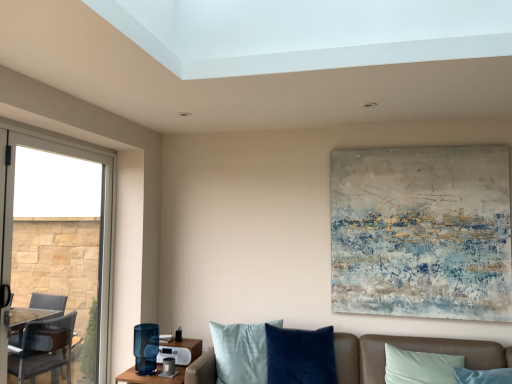
Question: Can you confirm if leather couch at lower right is positioned to the left of velvet brown couch at lower center?

Choices:
 (A) yes
 (B) no

Answer: (B)

Question: Would you consider leather couch at lower right to be distant from velvet brown couch at lower center?

Choices:
 (A) yes
 (B) no

Answer: (B)

Question: From a real-world perspective, is leather couch at lower right over velvet brown couch at lower center?

Choices:
 (A) no
 (B) yes

Answer: (B)

Question: Would you say leather couch at lower right is outside velvet brown couch at lower center?

Choices:
 (A) no
 (B) yes

Answer: (A)

Question: From the image's perspective, is leather couch at lower right below velvet brown couch at lower center?

Choices:
 (A) no
 (B) yes

Answer: (A)

Question: Is leather couch at lower right thinner than velvet brown couch at lower center?

Choices:
 (A) no
 (B) yes

Answer: (B)

Question: Is textured canvas painting at upper center closer to the viewer compared to velvet brown couch at lower center?

Choices:
 (A) yes
 (B) no

Answer: (B)

Question: Considering the relative sizes of textured canvas painting at upper center and velvet brown couch at lower center in the image provided, is textured canvas painting at upper center wider than velvet brown couch at lower center?

Choices:
 (A) no
 (B) yes

Answer: (A)

Question: Considering the relative sizes of textured canvas painting at upper center and velvet brown couch at lower center in the image provided, is textured canvas painting at upper center thinner than velvet brown couch at lower center?

Choices:
 (A) yes
 (B) no

Answer: (A)

Question: Is velvet brown couch at lower center inside textured canvas painting at upper center?

Choices:
 (A) yes
 (B) no

Answer: (B)

Question: From the image's perspective, is textured canvas painting at upper center beneath velvet brown couch at lower center?

Choices:
 (A) no
 (B) yes

Answer: (A)

Question: Could you tell me if textured canvas painting at upper center is turned towards velvet brown couch at lower center?

Choices:
 (A) no
 (B) yes

Answer: (A)

Question: Is leather couch at lower right a part of clear glass window at left?

Choices:
 (A) yes
 (B) no

Answer: (B)